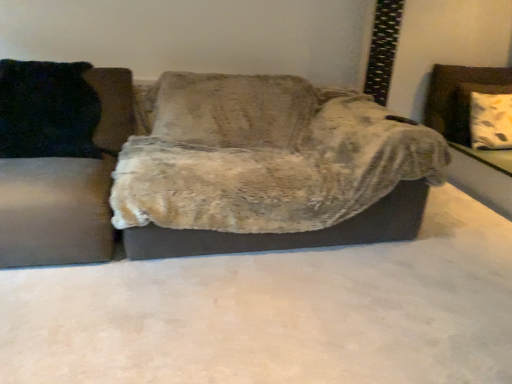
Question: Which is correct: black fuzzy pillow at left is inside white textured cushion at right, or outside of it?

Choices:
 (A) inside
 (B) outside

Answer: (B)

Question: Is point (25, 135) closer or farther from the camera than point (449, 178)?

Choices:
 (A) closer
 (B) farther

Answer: (A)

Question: Estimate the real-world distances between objects in this image. Which object is closer to the fuzzy fabric couch at center, the 1th studio couch in the right-to-left sequence?

Choices:
 (A) velvet black pillow at left, which is the first studio couch from left to right
 (B) white textured cushion at right
 (C) black fuzzy pillow at left

Answer: (A)

Question: Based on their relative distances, which object is farther from the velvet black pillow at left, which is the second studio couch from right to left?

Choices:
 (A) white textured cushion at right
 (B) black fuzzy pillow at left
 (C) fuzzy fabric couch at center, the 1th studio couch in the right-to-left sequence

Answer: (A)